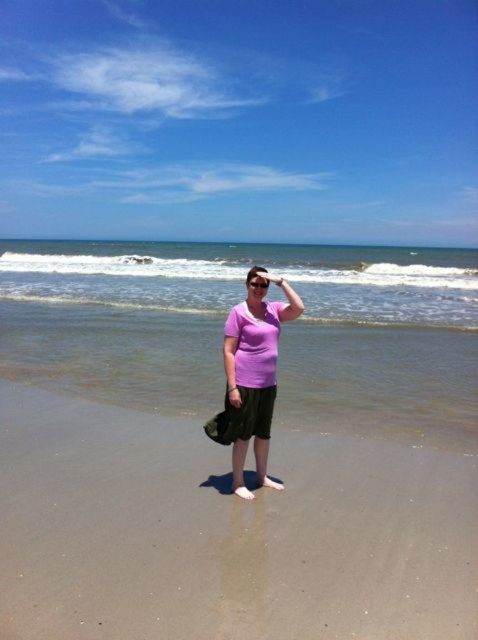
You are a photographer trying to capture the person on the beach. You want to include both the blue water at center and the transparent plastic goggles at center in your shot. Which object should you position to the left side of your frame to ensure both are visible?

You should position the transparent plastic goggles at center on the left side of your frame because the blue water at center is to the right of it, ensuring both are visible.

You are a photographer trying to capture the scene. You want to ensure the pink matte shirt at center is positioned to the left of the blue water at center in the photo. Based on the current arrangement, is this already the case?

Yes, the blue water at center is already to the right of the pink matte shirt at center, so the desired positioning is already achieved.

You are a photographer planning to take a picture of the beach scene. You want to ensure that both the smooth sand at center and the blue water at center are clearly visible in your shot. Based on their positions, which object should you focus on first to capture both in the same frame?

Since the smooth sand at center is located below the blue water at center, you should focus on the blue water at center first as it is higher up, allowing both objects to be in the same frame.